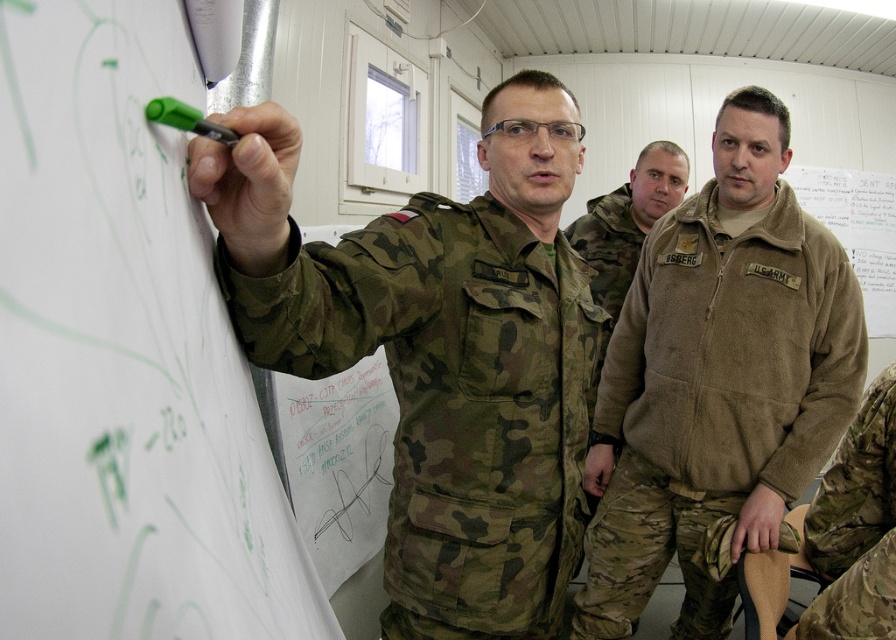
Question: Which is nearer to the camo uniform at center?

Choices:
 (A) green plastic pen at upper left
 (B) suede brown jacket at center
 (C) camouflage fabric jacket at center

Answer: (B)

Question: Which object appears farthest from the camera in this image?

Choices:
 (A) camouflage fabric jacket at center
 (B) green plastic pen at upper left
 (C) green matte marker at upper left

Answer: (A)

Question: Can you confirm if green matte marker at upper left is wider than camouflage fabric jacket at center?

Choices:
 (A) no
 (B) yes

Answer: (A)

Question: Does suede brown jacket at center come behind green plastic pen at upper left?

Choices:
 (A) no
 (B) yes

Answer: (B)

Question: Is camo uniform at center wider than green plastic pen at upper left?

Choices:
 (A) no
 (B) yes

Answer: (B)

Question: Among these points, which one is nearest to the camera?

Choices:
 (A) (149, 106)
 (B) (569, 554)
 (C) (593, 298)
 (D) (113, 628)

Answer: (D)